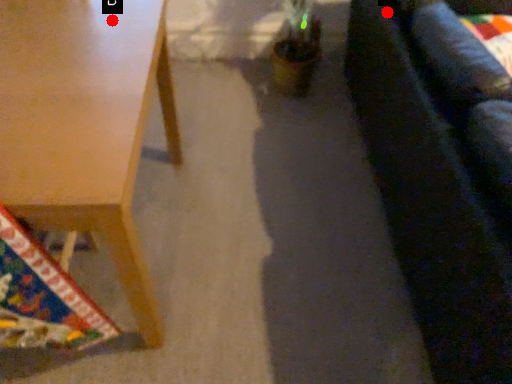
Question: Two points are circled on the image, labeled by A and B beside each circle. Which point is farther to the camera?

Choices:
 (A) A is further
 (B) B is further

Answer: (A)